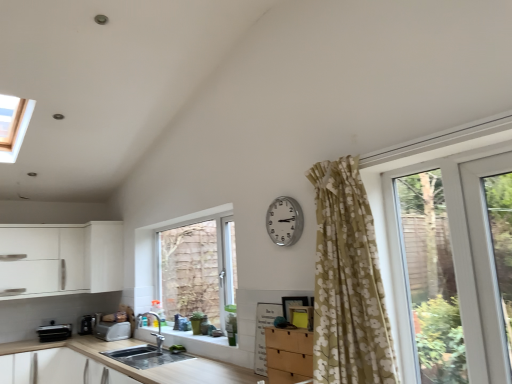
Question: Is white matte cabinet at left wider or thinner than metallic silver toaster at lower left, the second appliance viewed from the left?

Choices:
 (A) wide
 (B) thin

Answer: (A)

Question: From the image's perspective, is white matte cabinet at left above or below metallic silver toaster at lower left, the second appliance viewed from the left?

Choices:
 (A) above
 (B) below

Answer: (A)

Question: Which is farther from the wooden at lower left?

Choices:
 (A) white matte cabinet at left
 (B) black plastic toaster at lower left, which appears as the third appliance when viewed from the right
 (C) smooth concrete sink at lower center
 (D) white plastic screen door at right
 (E) white plastic toaster at lower left, the first appliance in the right-to-left sequence

Answer: (D)

Question: Which of these objects is positioned closest to the white plastic toaster at lower left, acting as the 3th appliance starting from the left?

Choices:
 (A) silver metallic clock at upper center
 (B) metallic silver toaster at lower left, the second appliance viewed from the left
 (C) smooth concrete sink at lower center
 (D) white matte cabinet at left
 (E) wooden at lower left

Answer: (B)